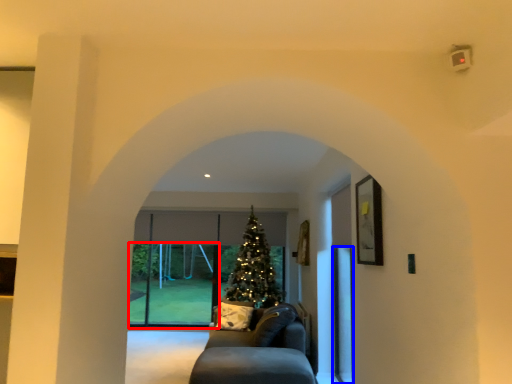
Question: Which point is closer to the camera, glass door (highlighted by a red box) or screen door (highlighted by a blue box)?

Choices:
 (A) glass door
 (B) screen door

Answer: (B)